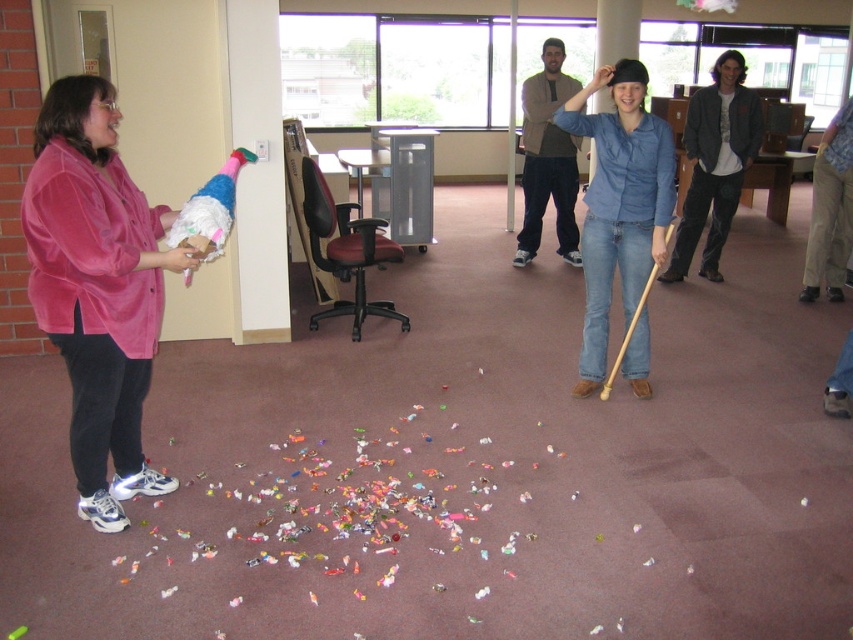
Question: In this image, where is velvet pink jacket at left located relative to denim shirt at center?

Choices:
 (A) right
 (B) left

Answer: (B)

Question: Is velvet pink jacket at left to the right of denim shirt at center from the viewer's perspective?

Choices:
 (A) no
 (B) yes

Answer: (A)

Question: Does velvet pink jacket at left appear on the left side of denim shirt at center?

Choices:
 (A) no
 (B) yes

Answer: (B)

Question: Which object appears farthest from the camera in this image?

Choices:
 (A) velvet pink jacket at left
 (B) denim shirt at center

Answer: (B)